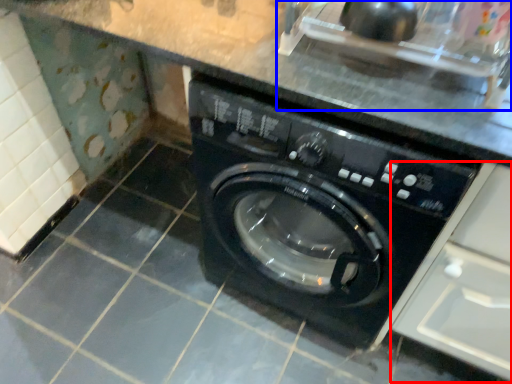
Question: Which point is closer to the camera, drawer (highlighted by a red box) or sink (highlighted by a blue box)?

Choices:
 (A) drawer
 (B) sink

Answer: (A)